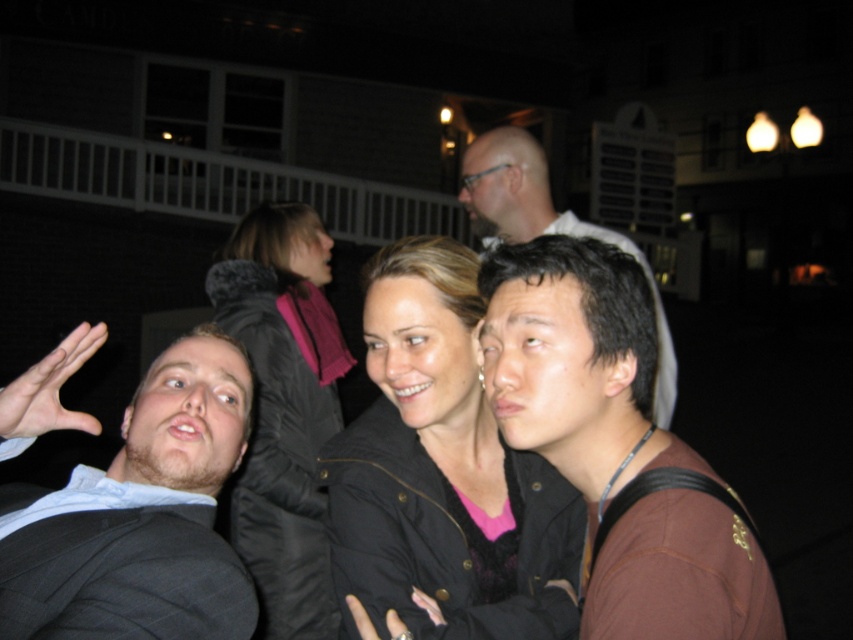
Question: Which of the following is the closest to the observer?

Choices:
 (A) (602, 269)
 (B) (560, 506)

Answer: (A)

Question: Which object is farther from the camera taking this photo?

Choices:
 (A) black leather jacket at center
 (B) gray suit at left
 (C) smooth brown hair at center

Answer: (A)

Question: Does black leather jacket at center appear on the right side of smooth brown hair at center?

Choices:
 (A) no
 (B) yes

Answer: (A)

Question: Among these objects, which one is nearest to the camera?

Choices:
 (A) brown matte jacket at center
 (B) black leather jacket at center
 (C) smooth brown hair at center
 (D) gray suit at left

Answer: (A)

Question: Is black leather jacket at center thinner than gray suit at left?

Choices:
 (A) no
 (B) yes

Answer: (B)

Question: Observing the image, what is the correct spatial positioning of gray suit at left in reference to smooth brown hair at center?

Choices:
 (A) right
 (B) left

Answer: (B)